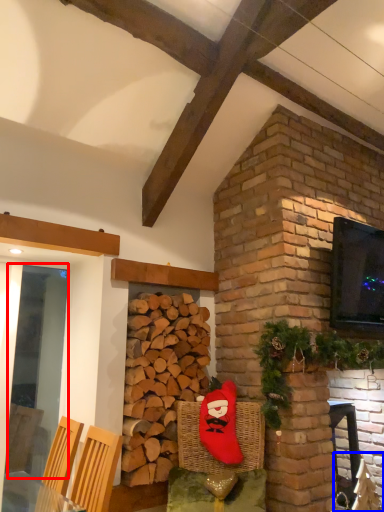
Question: Among these objects, which one is farthest to the camera, glass door (highlighted by a red box) or armchair (highlighted by a blue box)?

Choices:
 (A) glass door
 (B) armchair

Answer: (B)